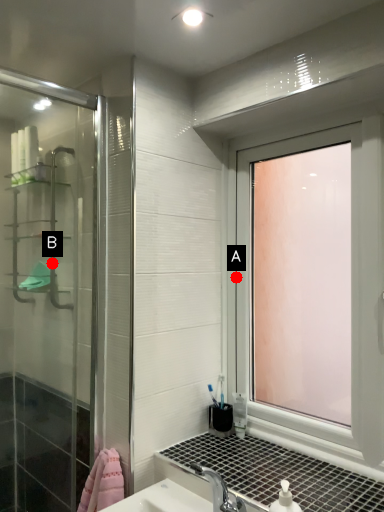
Question: Two points are circled on the image, labeled by A and B beside each circle. Which point is further to the camera?

Choices:
 (A) A is further
 (B) B is further

Answer: (B)